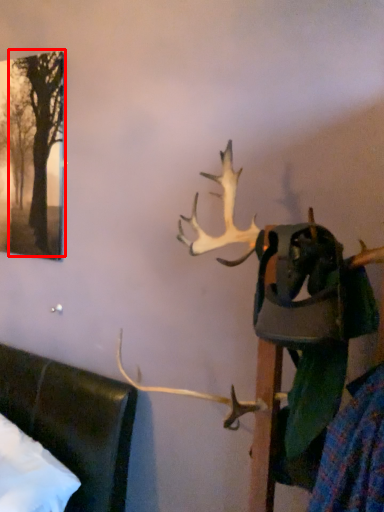
Question: From the image's perspective, considering the relative positions of tree (annotated by the red box) and deer in the image provided, where is tree (annotated by the red box) located with respect to the staircase?

Choices:
 (A) below
 (B) above

Answer: (B)